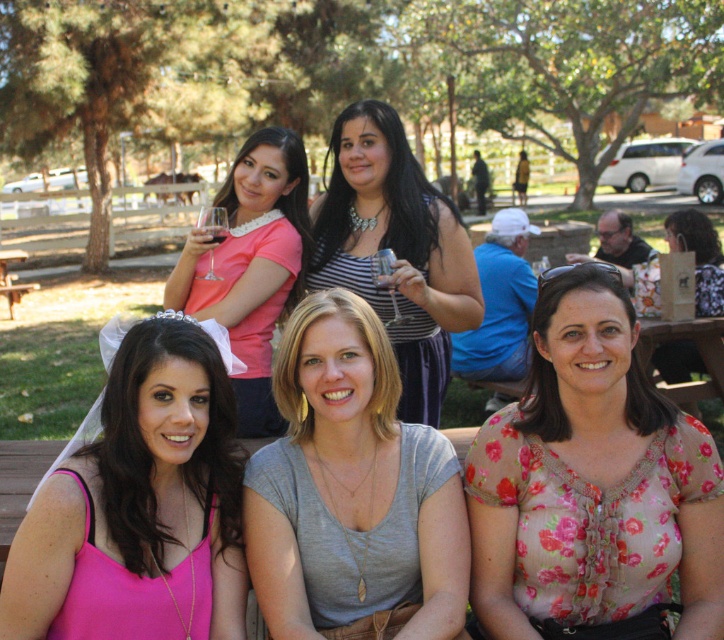
Question: Which of the following is the closest to the observer?

Choices:
 (A) gray cotton shirt at center
 (B) brown wooden picnic table at lower left

Answer: (A)

Question: Which of these objects is positioned farthest from the pink satin dress at lower left?

Choices:
 (A) brown wooden picnic table at lower left
 (B) floral sheer blouse at lower right

Answer: (A)

Question: Considering the real-world distances, which object is farthest from the gray cotton shirt at center?

Choices:
 (A) brown wooden picnic table at lower left
 (B) pink satin dress at lower left
 (C) striped fabric dress at center
 (D) floral sheer blouse at lower right

Answer: (A)

Question: Does floral fabric dress at lower right lie in front of brown wooden picnic table at lower left?

Choices:
 (A) no
 (B) yes

Answer: (B)

Question: Is gray cotton shirt at center wider than striped fabric dress at center?

Choices:
 (A) no
 (B) yes

Answer: (A)

Question: Can you confirm if pink satin dress at lower left is positioned below striped fabric dress at center?

Choices:
 (A) no
 (B) yes

Answer: (B)